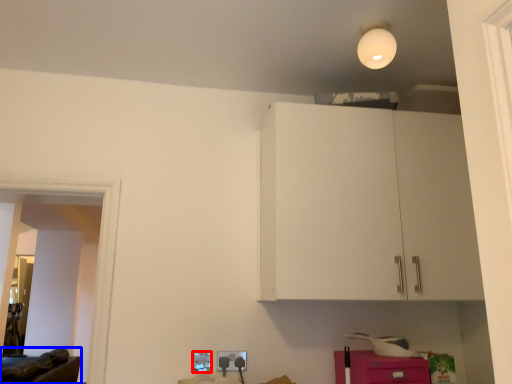
Question: Which object appears farthest to the camera in this image, electric outlet (highlighted by a red box) or furniture (highlighted by a blue box)?

Choices:
 (A) electric outlet
 (B) furniture

Answer: (B)